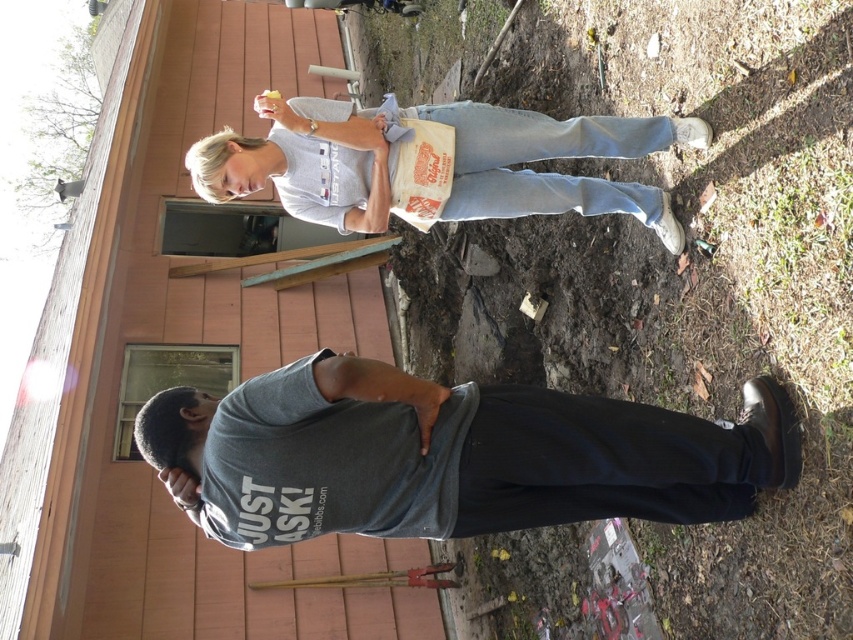
You are standing at point [28,93] and want to walk to the house. Which direction should you go to avoid walking through point [357,452]?

Since point [357,452] is in front of point [28,93], you should go behind point [357,452] to reach the house without passing through it.

You are a delivery person who needs to place a package on the ground between the white paper bag at upper center and the green leafy tree at upper left. Based on the scene, can you confirm if there is enough space between them for the package?

The white paper bag at upper center is below the green leafy tree at upper left, so there is vertical space between them. However, the scene description mentions scattered debris and tools on the ground, which may obstruct placing the package. Check the ground for clear space before placing the package.

You are a delivery person who needs to place a package at the point with coordinates (434,163). According to the image, where should you place the package?

The point (434,163) is on the white paper bag at upper center, so you should place the package on the white paper bag at upper center.